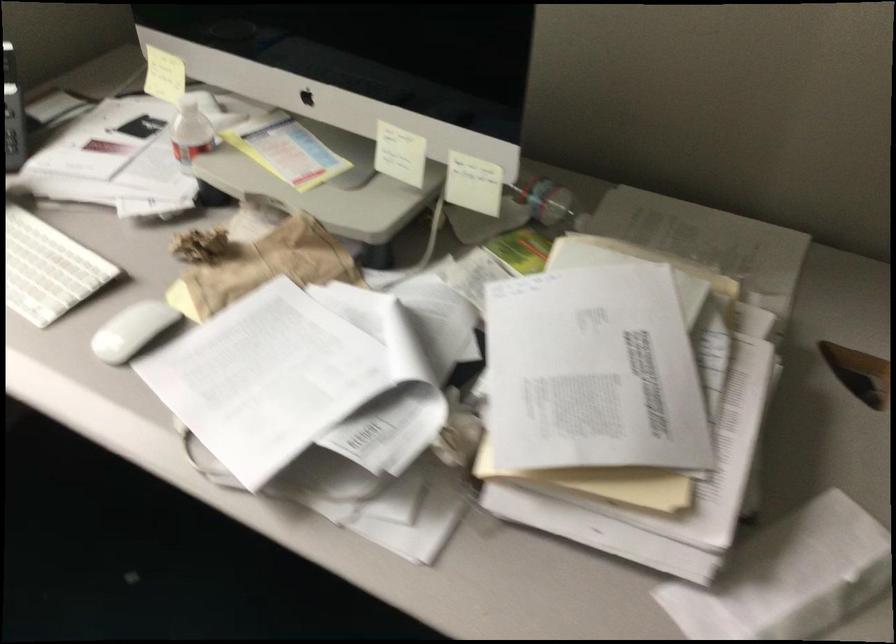
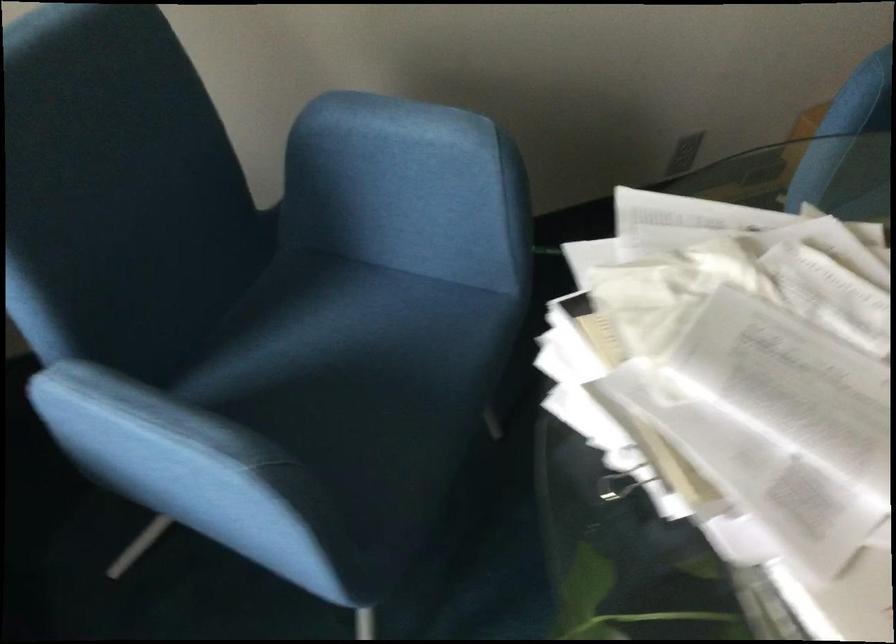
Looking at this image, the first image is from the beginning of the video and the second image is from the end. How did the camera likely rotate when shooting the video?

The rotation direction of the camera is right-down.